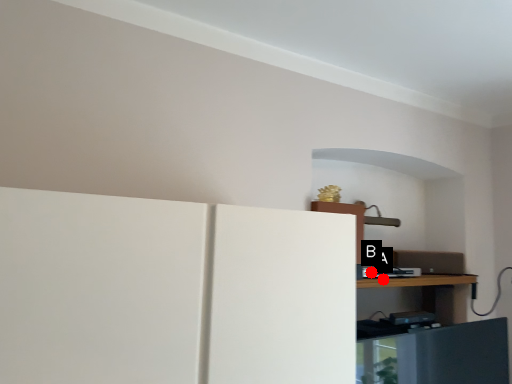
Question: Two points are circled on the image, labeled by A and B beside each circle. Which point is closer to the camera?

Choices:
 (A) A is closer
 (B) B is closer

Answer: (A)